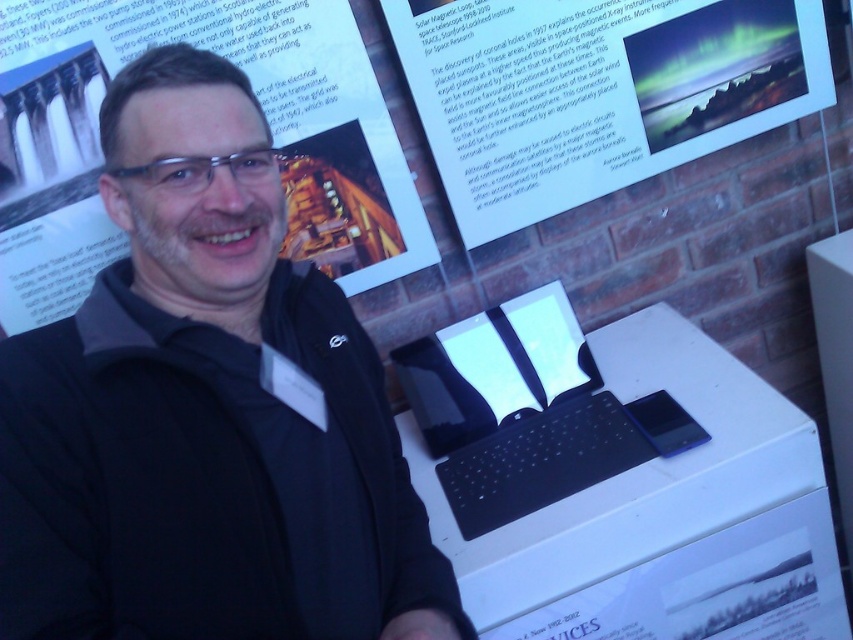
Question: From the image, what is the correct spatial relationship of white plastic printer at center in relation to white paper poster at upper center?

Choices:
 (A) above
 (B) below

Answer: (B)

Question: Among these objects, which one is nearest to the camera?

Choices:
 (A) black glossy laptop at center
 (B) white paper at upper center
 (C) black matte jacket at center
 (D) white paper poster at upper center

Answer: (C)

Question: Which point is closer to the camera?

Choices:
 (A) (184, 240)
 (B) (238, 32)
 (C) (741, 369)
 (D) (550, 378)

Answer: (A)

Question: Which object is positioned farthest from the black glossy laptop at center?

Choices:
 (A) black matte jacket at center
 (B) white paper at upper center
 (C) white paper poster at upper center
 (D) white plastic printer at center

Answer: (C)

Question: Considering the relative positions of black matte jacket at center and white paper at upper center in the image provided, where is black matte jacket at center located with respect to white paper at upper center?

Choices:
 (A) right
 (B) left

Answer: (B)

Question: From the image, what is the correct spatial relationship of black matte jacket at center in relation to white paper poster at upper center?

Choices:
 (A) left
 (B) right

Answer: (B)